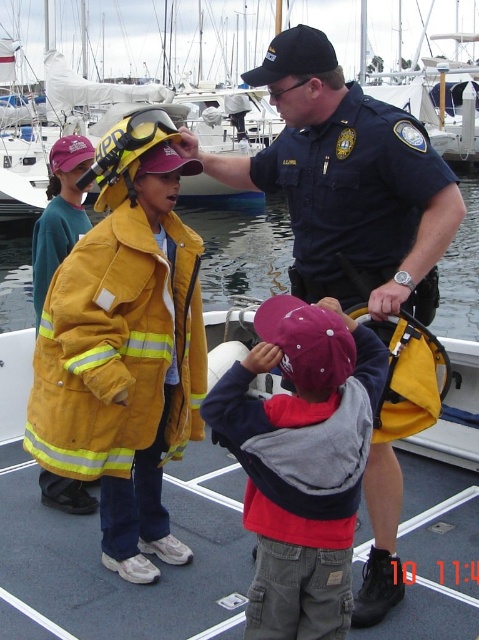
Is maroon fabric cap at center further to the viewer compared to yellow fire-resistant jacket at left?

No, maroon fabric cap at center is in front of yellow fire-resistant jacket at left.

Is point (273, 417) less distant than point (47, 285)?

Yes, it is.

Between point (348, 540) and point (80, 212), which one is positioned in front?

Point (348, 540) is more forward.

Where is `maroon fabric cap at center`? The width and height of the screenshot is (479, 640). maroon fabric cap at center is located at coordinates (301, 472).

Who is lower down, yellow fireproof jacket at left or dark blue uniform at center?

yellow fireproof jacket at left is below.

Is point (178, 326) farther from viewer compared to point (390, 108)?

That is True.

Is point (140, 150) behind point (299, 241)?

No, (140, 150) is closer to viewer.

Where is `yellow fireproof jacket at left`? Image resolution: width=479 pixels, height=640 pixels. yellow fireproof jacket at left is located at coordinates (125, 346).

Is point (44, 404) positioned behind point (63, 228)?

No, (44, 404) is closer to viewer.

Find the location of a particular element. yellow fireproof jacket at left is located at coordinates (125, 346).